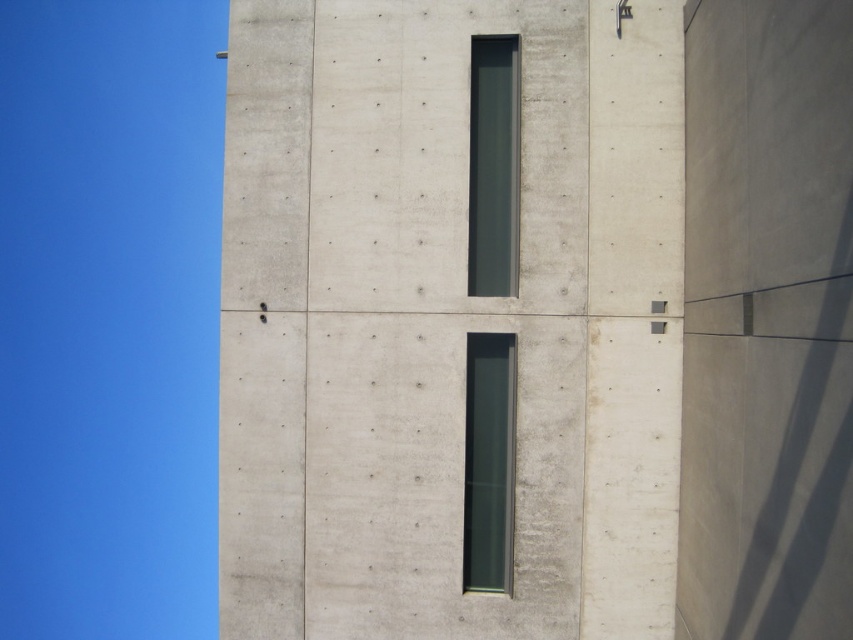
You are standing in front of a modern building with a light gray concrete wall. You see a point marked at coordinates (492, 166). Based on the scene description, what object is located at this point?

The point at coordinates (492, 166) indicates the location of the dark gray glass window at upper center.

You are an architect designing a new building and want to ensure that the smooth concrete wall at center and the dark gray glass window at upper center meet specific size requirements. According to the design specifications, the wall must be larger than the window. Does the current layout comply with this requirement?

The smooth concrete wall at center has a smaller size compared to dark gray glass window at upper center, so the current layout does not comply with the requirement that the wall must be larger than the window.

You are a maintenance worker inspecting the exterior wall of the building. You notice a specific point at coordinates point (x=445, y=320). Based on the scene description, what is the surface condition of the wall at that point?

The point (x=445, y=320) indicates smooth concrete wall at center, so the surface is smooth there.